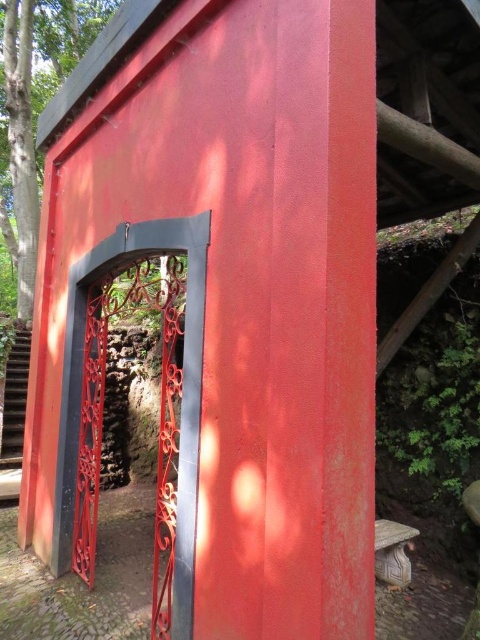
Is green leafy tree at upper left to the right of carved stone stool at lower right from the viewer's perspective?

In fact, green leafy tree at upper left is to the left of carved stone stool at lower right.

Is green leafy tree at upper left thinner than carved stone stool at lower right?

No.

Between point (48, 60) and point (405, 525), which one is positioned in front?

Point (405, 525)

This screenshot has width=480, height=640. In order to click on green leafy tree at upper left in this screenshot , I will do `click(36, 106)`.

Does wrought iron gate at center come behind green leafy tree at upper left?

No.

Does wrought iron gate at center have a larger size compared to green leafy tree at upper left?

Incorrect, wrought iron gate at center is not larger than green leafy tree at upper left.

Which is in front, point (187, 472) or point (24, 160)?

Point (187, 472)

The width and height of the screenshot is (480, 640). Identify the location of wrought iron gate at center. (182, 390).

Who is higher up, wrought iron gate at center or carved stone stool at lower right?

wrought iron gate at center

Does wrought iron gate at center have a greater height compared to carved stone stool at lower right?

Yes, wrought iron gate at center is taller than carved stone stool at lower right.

Describe the element at coordinates (182, 390) in the screenshot. I see `wrought iron gate at center` at that location.

I want to click on wrought iron gate at center, so click(x=182, y=390).